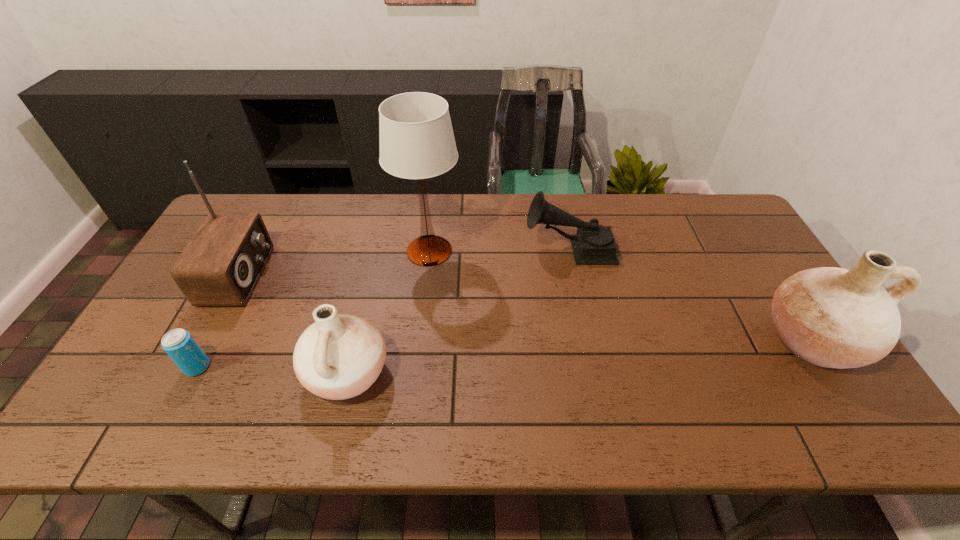
I want to click on the shorter pottery, so click(339, 356).

Identify the location of the taller pottery. This screenshot has height=540, width=960. (831, 317).

I want to click on the rightmost object, so click(x=831, y=317).

I want to click on radio receiver, so click(x=220, y=266).

Locate an element on the screen. The image size is (960, 540). table lamp is located at coordinates (416, 140).

The image size is (960, 540). I want to click on the fifth object from left to right, so click(593, 244).

The width and height of the screenshot is (960, 540). I want to click on soda can, so click(179, 344).

Identify the location of vacant space located to pour from the handle of the left pottery. (259, 373).

Identify the location of vacant space located 0.130m to pour from the handle of the left pottery. This screenshot has width=960, height=540. (252, 373).

This screenshot has width=960, height=540. I want to click on vacant space positioned 0.260m to pour from the handle of the left pottery, so click(x=198, y=373).